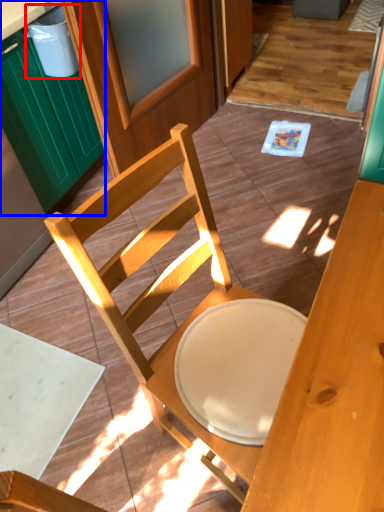
Question: Which object appears closest to the camera in this image, trash bin/can (highlighted by a red box) or cabinetry (highlighted by a blue box)?

Choices:
 (A) trash bin/can
 (B) cabinetry

Answer: (B)